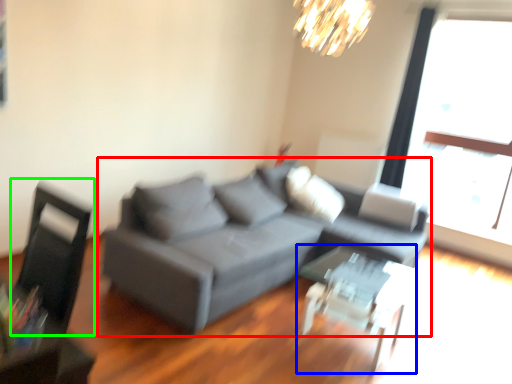
Question: Based on their relative distances, which object is farther from studio couch (highlighted by a red box)? Choose from table (highlighted by a blue box) and swivel chair (highlighted by a green box).

Choices:
 (A) table
 (B) swivel chair

Answer: (B)